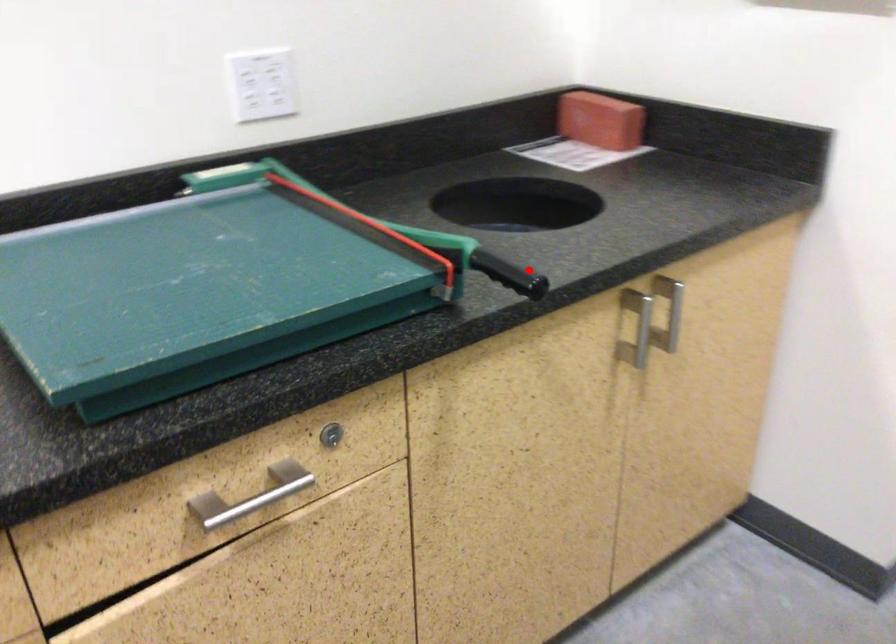
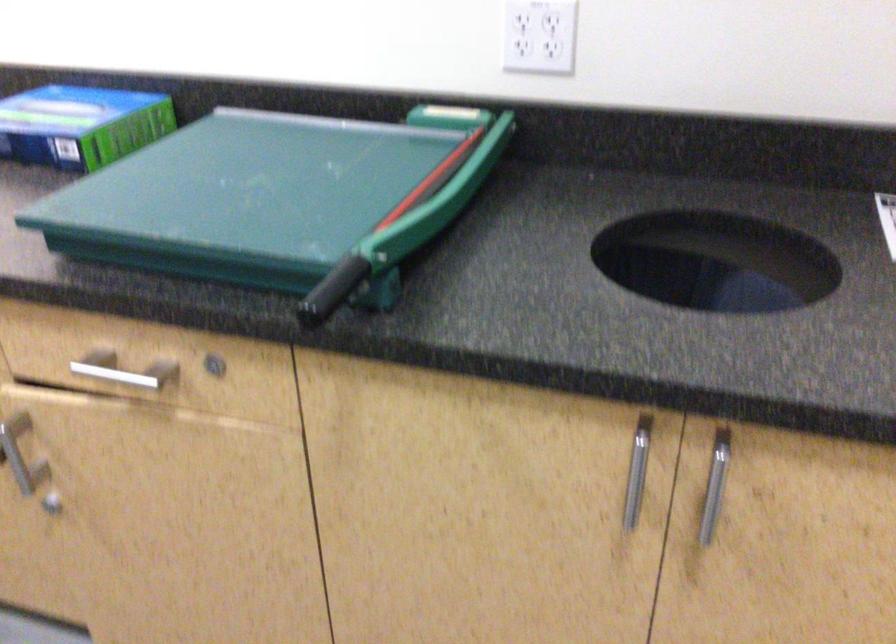
Find the pixel in the second image that matches the highlighted location in the first image.

(332, 290)